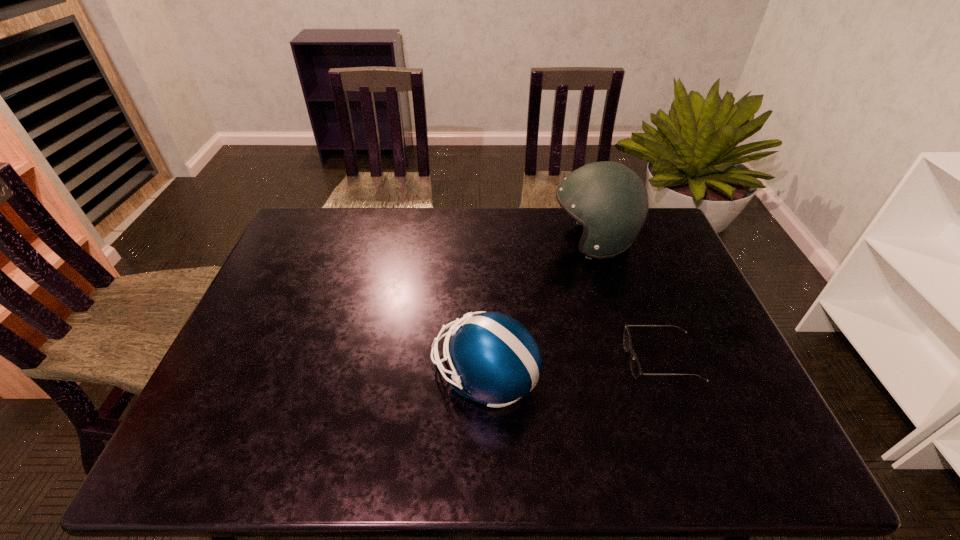
Identify the location of the tallest object. (609, 199).

Identify the location of the farther football helmet. (609, 199).

Where is `the shorter football helmet`? This screenshot has height=540, width=960. the shorter football helmet is located at coordinates (494, 359).

Locate an element on the screen. Image resolution: width=960 pixels, height=540 pixels. the left football helmet is located at coordinates (494, 359).

The image size is (960, 540). In order to click on spectacles in this screenshot , I will do `click(635, 367)`.

Identify the location of vacant space positioned 0.290m at the face opening of the farther football helmet. Image resolution: width=960 pixels, height=540 pixels. pyautogui.click(x=463, y=241).

What are the coordinates of `blank space located at the face opening of the farther football helmet` in the screenshot? It's located at (471, 241).

Where is `vacant region located at the face opening of the farther football helmet`? The image size is (960, 540). vacant region located at the face opening of the farther football helmet is located at coordinates (490, 241).

Image resolution: width=960 pixels, height=540 pixels. In order to click on vacant area located at the front of the second shortest object with the faceguard in this screenshot , I will do `click(299, 375)`.

What are the coordinates of `vacant area located at the front of the second shortest object with the faceguard` in the screenshot? It's located at (377, 375).